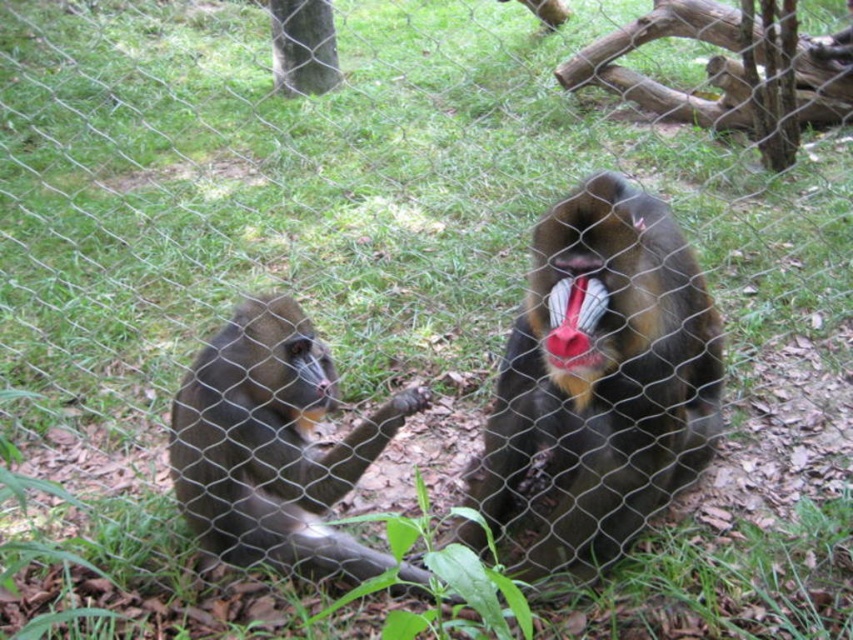
Looking at this image, you are a zookeeper observing the mandrills in their enclosure. You notice the brown furry monkey at left and the bright red fur at mouth right. Which one is taller?

The brown furry monkey at left is taller than the bright red fur at mouth right.

You are a zookeeper observing the mandrills in their enclosure. You notice the shiny brown monkey at center and the brown furry monkey at left. Which one is taller?

The shiny brown monkey at center is taller than the brown furry monkey at left.

You are a zookeeper observing the mandrills in their enclosure. You notice the shiny brown monkey at center and the bright red fur at mouth right. Which of these two is closer to you?

The shiny brown monkey at center is closer to you because it is in front of the bright red fur at mouth right.